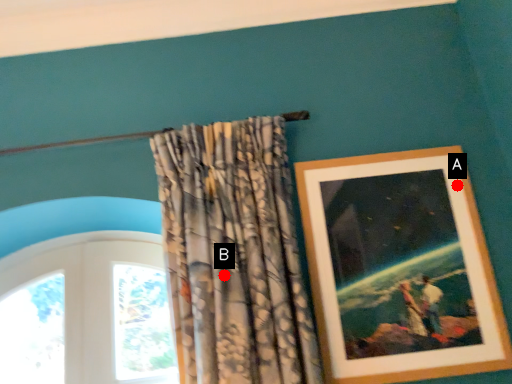
Question: Two points are circled on the image, labeled by A and B beside each circle. Which point is closer to the camera taking this photo?

Choices:
 (A) A is closer
 (B) B is closer

Answer: (B)